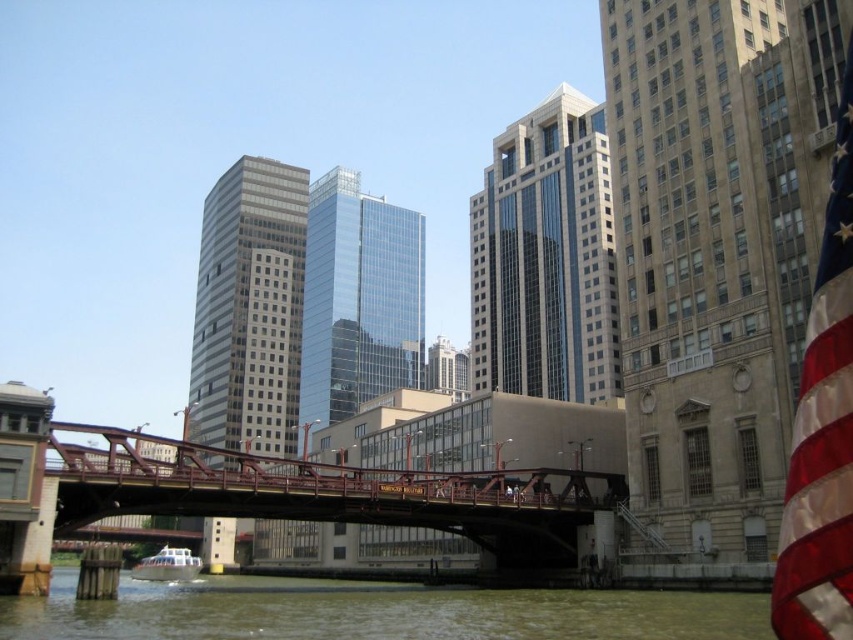
Is greenish water at lower center thinner than red fabric flag at right?

In fact, greenish water at lower center might be wider than red fabric flag at right.

From the picture: Who is positioned more to the left, greenish water at lower center or red fabric flag at right?

greenish water at lower center

Which is in front, point (76, 604) or point (825, 369)?

Point (825, 369) is more forward.

Find the location of a particular element. The width and height of the screenshot is (853, 640). greenish water at lower center is located at coordinates (375, 611).

Does greenish water at lower center have a lesser height compared to white matte boat at lower center?

No.

The height and width of the screenshot is (640, 853). I want to click on greenish water at lower center, so click(375, 611).

The image size is (853, 640). Identify the location of greenish water at lower center. (375, 611).

Which of these two, red fabric flag at right or white matte boat at lower center, stands taller?

With more height is red fabric flag at right.

Between point (822, 468) and point (161, 563), which one is positioned behind?

The point (161, 563) is behind.

Who is more distant from viewer, (x=839, y=420) or (x=136, y=579)?

The point (x=136, y=579) is more distant.

What are the coordinates of `red fabric flag at right` in the screenshot? It's located at (822, 429).